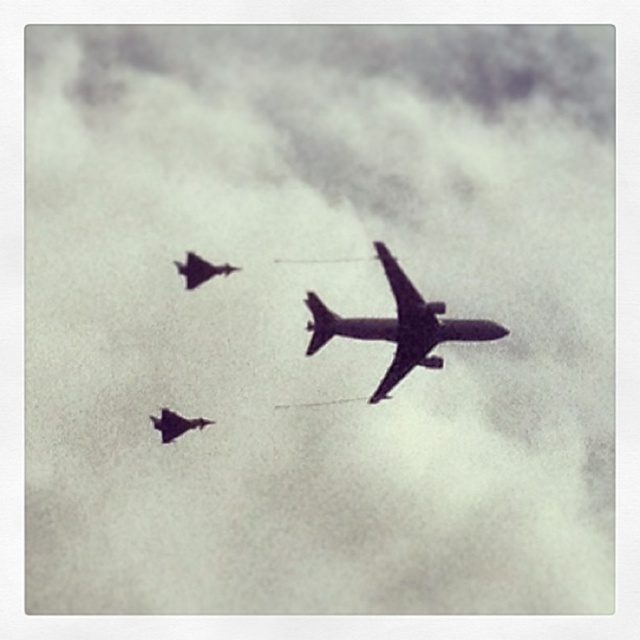
Between shiny metallic airplane at center and shiny dark gray jet at left, which one has more height?

Standing taller between the two is shiny metallic airplane at center.

Is shiny metallic airplane at center positioned before shiny dark gray jet at left?

No, it is behind shiny dark gray jet at left.

Which is behind, point (323, 342) or point (179, 262)?

Point (323, 342)

This screenshot has height=640, width=640. I want to click on shiny metallic airplane at center, so click(x=397, y=326).

Can you confirm if shiny metallic airplane at center is positioned above shiny dark gray jet at lower left?

Yes, shiny metallic airplane at center is above shiny dark gray jet at lower left.

Consider the image. Can you confirm if shiny metallic airplane at center is thinner than shiny dark gray jet at lower left?

Incorrect, shiny metallic airplane at center's width is not less than shiny dark gray jet at lower left's.

Does point (454, 337) come in front of point (164, 426)?

That is False.

I want to click on shiny metallic airplane at center, so click(397, 326).

Does shiny dark gray jet at left appear on the left side of shiny dark gray jet at lower left?

No, shiny dark gray jet at left is not to the left of shiny dark gray jet at lower left.

Is point (184, 280) positioned in front of point (163, 422)?

No, (184, 280) is behind (163, 422).

Find the location of a particular element. The height and width of the screenshot is (640, 640). shiny dark gray jet at left is located at coordinates (200, 269).